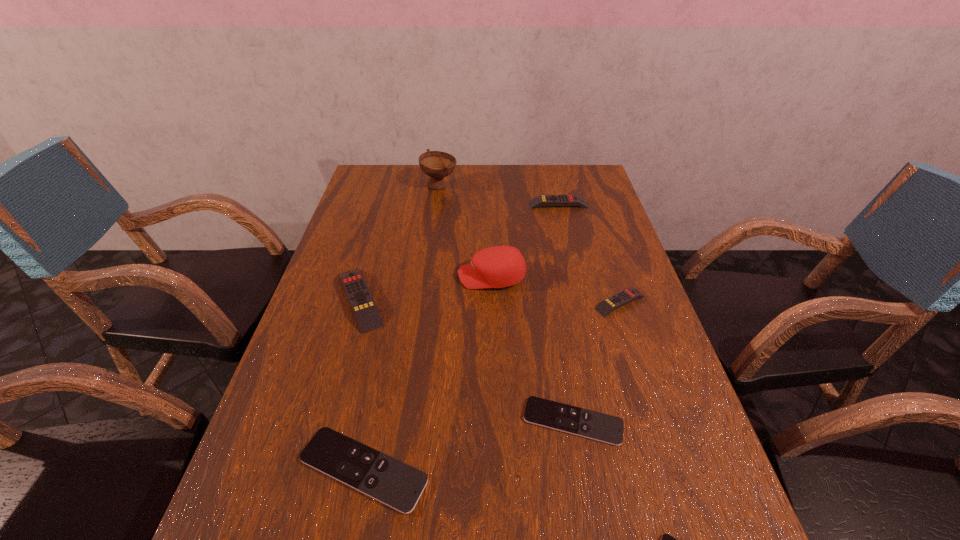
I want to click on the sixth tallest object, so click(398, 485).

Identify the location of the leftmost black remote control. (398, 485).

This screenshot has width=960, height=540. Find the location of `the second shortest object`. the second shortest object is located at coordinates (605, 428).

In order to click on the second biggest black remote control in this screenshot , I will do `click(605, 428)`.

Find the location of a particular element. vacant space located 0.140m on the right of the farthest object is located at coordinates (497, 186).

Locate an element on the screen. vacant space located 0.310m on the front-facing side of the seventh shortest object is located at coordinates (344, 277).

This screenshot has height=540, width=960. Find the location of `vacant space situated 0.310m on the front-facing side of the seventh shortest object`. vacant space situated 0.310m on the front-facing side of the seventh shortest object is located at coordinates click(344, 277).

Where is `vacant area situated on the front-facing side of the seventh shortest object`? The image size is (960, 540). vacant area situated on the front-facing side of the seventh shortest object is located at coordinates [417, 277].

Identify the location of free space located 0.270m on the front of the biggest yellow remote control. The image size is (960, 540). (319, 442).

You are a GUI agent. You are given a task and a screenshot of the screen. Output one action in this format:
    pyautogui.click(x=<x>, y=<y>)
    Task: Click on the free space located 0.050m on the left of the farthest remote control
    The height and width of the screenshot is (540, 960).
    Given the screenshot: What is the action you would take?
    pyautogui.click(x=515, y=205)